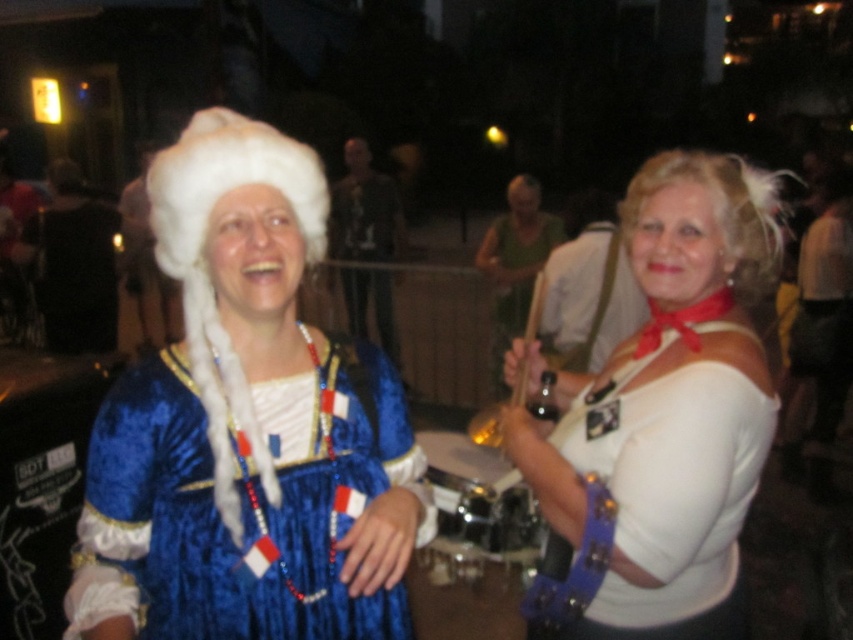
Is point (347, 556) less distant than point (668, 179)?

Yes, point (347, 556) is closer to viewer.

Between velvet blue dress at center and white feathered wig at upper right, which one is positioned higher?

Positioned higher is white feathered wig at upper right.

Who is more distant from viewer, (196,250) or (630,196)?

The point (630,196) is more distant.

Identify the location of velvet blue dress at center. This screenshot has width=853, height=640. (245, 428).

Is point (309, 440) in front of point (189, 310)?

No, it is behind (189, 310).

Can you confirm if velvet blue dress at center is positioned to the left of white fluffy wig at upper left?

No, velvet blue dress at center is not to the left of white fluffy wig at upper left.

This screenshot has width=853, height=640. Describe the element at coordinates (245, 428) in the screenshot. I see `velvet blue dress at center` at that location.

At what (x,y) coordinates should I click in order to perform the action: click on velvet blue dress at center. Please return your answer as a coordinate pair (x, y). Looking at the image, I should click on (245, 428).

Which of these two, white matte shirt at center or white fluffy wig at upper left, stands shorter?

white fluffy wig at upper left

What do you see at coordinates (668, 412) in the screenshot?
I see `white matte shirt at center` at bounding box center [668, 412].

The image size is (853, 640). I want to click on white matte shirt at center, so click(668, 412).